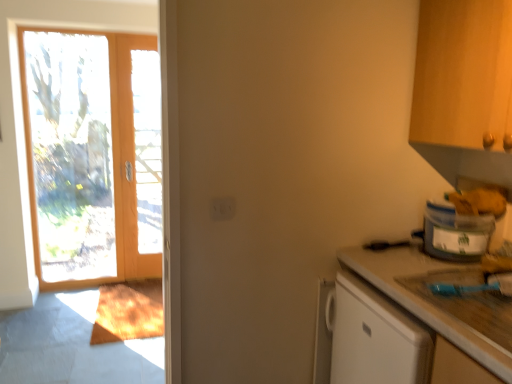
Image resolution: width=512 pixels, height=384 pixels. I want to click on vacant space positioned to the left of translucent plastic container at right, so click(x=401, y=261).